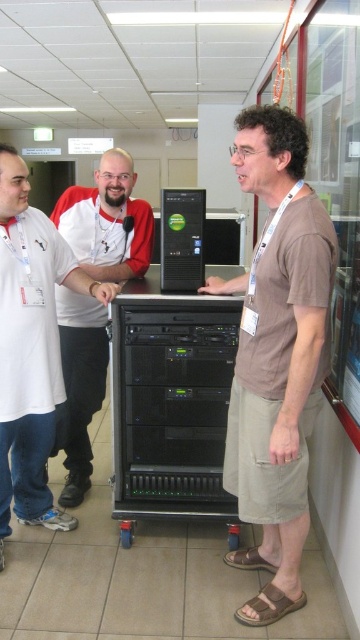
Between matte white shirt at left and matte black server at center, which one has more height?

matte black server at center is taller.

Between matte white shirt at left and matte black server at center, which one appears on the right side from the viewer's perspective?

From the viewer's perspective, matte black server at center appears more on the right side.

Does point (33, 524) come behind point (78, 362)?

That is False.

This screenshot has width=360, height=640. Identify the location of matte white shirt at left. (30, 348).

Is point (299, 282) positioned in front of point (82, 260)?

Yes, it is in front of point (82, 260).

What do you see at coordinates (276, 355) in the screenshot? I see `brown cotton shirt at center` at bounding box center [276, 355].

Is point (235, 426) farther from viewer compared to point (61, 328)?

No, it is not.

Image resolution: width=360 pixels, height=640 pixels. Find the location of `brown cotton shirt at center`. brown cotton shirt at center is located at coordinates (276, 355).

Is matte white shirt at left above black plastic computer at center?

Actually, matte white shirt at left is below black plastic computer at center.

Is point (54, 339) in front of point (171, 268)?

That is True.

Is point (55, 353) closer to viewer compared to point (173, 248)?

Yes, point (55, 353) is in front of point (173, 248).

This screenshot has height=640, width=360. Identify the location of matte white shirt at left. (30, 348).